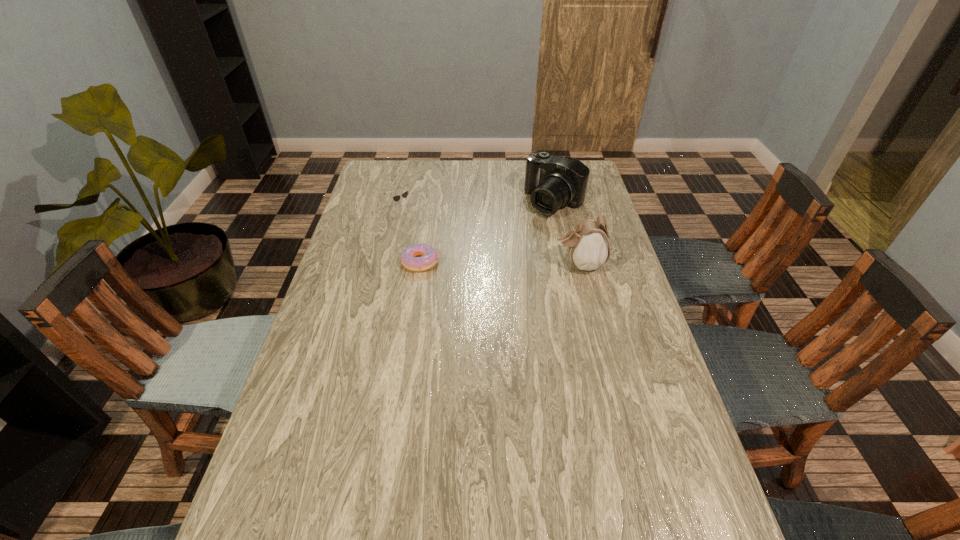
The height and width of the screenshot is (540, 960). What are the coordinates of `free space on the desktop that is between the shortest object and the pouch and is positioned on the lens of the camera` in the screenshot? It's located at (488, 263).

This screenshot has height=540, width=960. Identify the location of free space on the desktop that is between the doughnut and the pouch and is positioned in front of the lenses of the sunglasses. (476, 263).